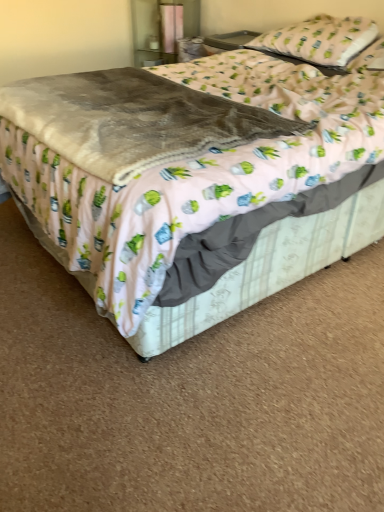
What is the approximate height of white fabric pillow at upper right, which is counted as the second pillow, starting from the top?

It is 12.10 centimeters.

This screenshot has height=512, width=384. In order to click on velvety gray blanket at center in this screenshot , I will do coord(132,120).

Locate an element on the screen. white fabric pillow at upper right, the second pillow ordered from the bottom is located at coordinates (319, 40).

Is velvet gray blanket at center far away from white fabric pillow at upper right, the second pillow ordered from the bottom?

Actually, velvet gray blanket at center and white fabric pillow at upper right, the second pillow ordered from the bottom, are a little close together.

Considering the positions of objects velvet gray blanket at center and white fabric pillow at upper right, acting as the first pillow starting from the top, in the image provided, who is more to the right, velvet gray blanket at center or white fabric pillow at upper right, acting as the first pillow starting from the top,?

white fabric pillow at upper right, acting as the first pillow starting from the top.

From the image's perspective, which is above, velvet gray blanket at center or white fabric pillow at upper right, the second pillow ordered from the bottom?

white fabric pillow at upper right, the second pillow ordered from the bottom, appears higher in the image.

Locate an element on the screen. blanket below the white fabric pillow at upper right, the second pillow ordered from the bottom (from the image's perspective) is located at coordinates tap(132, 120).

Which object is more forward, white fabric pillow at upper right, the second pillow ordered from the bottom, or velvety gray blanket at center?

Positioned in front is velvety gray blanket at center.

Which of these two, white fabric pillow at upper right, acting as the first pillow starting from the top, or velvety gray blanket at center, is wider?

With larger width is velvety gray blanket at center.

Is white fabric pillow at upper right, the second pillow ordered from the bottom, looking in the opposite direction of velvety gray blanket at center?

No, velvety gray blanket at center is not at the back of white fabric pillow at upper right, the second pillow ordered from the bottom.

From the picture: Is velvety gray blanket at center next to white fabric pillow at upper right, acting as the first pillow starting from the top?

velvety gray blanket at center and white fabric pillow at upper right, acting as the first pillow starting from the top, are not in contact.

Between velvety gray blanket at center and white fabric pillow at upper right, the second pillow ordered from the bottom, which one has larger width?

Wider between the two is velvety gray blanket at center.

Is the depth of velvety gray blanket at center less than that of white fabric pillow at upper right, acting as the first pillow starting from the top?

Yes, velvety gray blanket at center is in front of white fabric pillow at upper right, acting as the first pillow starting from the top.

Is velvety gray blanket at center to the left of white fabric pillow at upper right, the second pillow ordered from the bottom, from the viewer's perspective?

Yes, velvety gray blanket at center is to the left of white fabric pillow at upper right, the second pillow ordered from the bottom.

Is white fabric pillow at upper right, positioned as the 1th pillow in bottom-to-top order, at the back of white fabric pillow at upper right, acting as the first pillow starting from the top?

That's not correct — white fabric pillow at upper right, acting as the first pillow starting from the top, is not looking away from white fabric pillow at upper right, positioned as the 1th pillow in bottom-to-top order.

Does white fabric pillow at upper right, acting as the first pillow starting from the top, have a lesser height compared to white fabric pillow at upper right, which is counted as the second pillow, starting from the top?

Incorrect, the height of white fabric pillow at upper right, acting as the first pillow starting from the top, does not fall short of that of white fabric pillow at upper right, which is counted as the second pillow, starting from the top.

Relative to white fabric pillow at upper right, positioned as the 1th pillow in bottom-to-top order, is white fabric pillow at upper right, the second pillow ordered from the bottom, in front or behind?

Clearly, white fabric pillow at upper right, the second pillow ordered from the bottom, is behind white fabric pillow at upper right, positioned as the 1th pillow in bottom-to-top order.

Is white fabric pillow at upper right, the second pillow ordered from the bottom, located outside velvet gray blanket at center?

No, white fabric pillow at upper right, the second pillow ordered from the bottom, is not outside of velvet gray blanket at center.

Is white fabric pillow at upper right, acting as the first pillow starting from the top, far from velvet gray blanket at center?

Actually, white fabric pillow at upper right, acting as the first pillow starting from the top, and velvet gray blanket at center are a little close together.

From the picture: Is white fabric pillow at upper right, the second pillow ordered from the bottom, aimed at velvet gray blanket at center?

No.

Relative to velvet gray blanket at center, is white fabric pillow at upper right, the second pillow ordered from the bottom, in front or behind?

white fabric pillow at upper right, the second pillow ordered from the bottom, is behind velvet gray blanket at center.

From the image's perspective, which object appears higher, velvety gray blanket at center or velvet gray blanket at center?

velvety gray blanket at center appears higher in the image.

Looking at this image, can you confirm if velvety gray blanket at center is positioned to the left of velvet gray blanket at center?

Correct, you'll find velvety gray blanket at center to the left of velvet gray blanket at center.

What are the coordinates of `blanket that is behind the velvet gray blanket at center` in the screenshot? It's located at (132, 120).

Which is in front, velvety gray blanket at center or velvet gray blanket at center?

velvet gray blanket at center.

Is white fabric pillow at upper right, positioned as the 1th pillow in bottom-to-top order, touching velvety gray blanket at center?

white fabric pillow at upper right, positioned as the 1th pillow in bottom-to-top order, is not next to velvety gray blanket at center, and they're not touching.

From the image's perspective, is white fabric pillow at upper right, which is counted as the second pillow, starting from the top, on top of velvety gray blanket at center?

Yes, from the image's perspective, white fabric pillow at upper right, which is counted as the second pillow, starting from the top, is above velvety gray blanket at center.

Is white fabric pillow at upper right, which is counted as the second pillow, starting from the top, not inside velvety gray blanket at center?

That's correct, white fabric pillow at upper right, which is counted as the second pillow, starting from the top, is outside of velvety gray blanket at center.

This screenshot has height=512, width=384. I want to click on bed on the left of white fabric pillow at upper right, acting as the first pillow starting from the top, so click(x=207, y=201).

You are a GUI agent. You are given a task and a screenshot of the screen. Output one action in this format:
    pyautogui.click(x=<x>, y=<y>)
    Task: Click on the 2nd pillow behind the velvety gray blanket at center, starting your count from the anchor
    The width and height of the screenshot is (384, 512).
    Given the screenshot: What is the action you would take?
    pyautogui.click(x=319, y=40)

Looking at the image, which one is located further to velvet gray blanket at center, white fabric pillow at upper right, positioned as the 1th pillow in bottom-to-top order, or white fabric pillow at upper right, the second pillow ordered from the bottom?

The object further to velvet gray blanket at center is white fabric pillow at upper right, positioned as the 1th pillow in bottom-to-top order.

Based on their spatial positions, is white fabric pillow at upper right, acting as the first pillow starting from the top, or velvety gray blanket at center closer to white fabric pillow at upper right, positioned as the 1th pillow in bottom-to-top order?

The object closer to white fabric pillow at upper right, positioned as the 1th pillow in bottom-to-top order, is white fabric pillow at upper right, acting as the first pillow starting from the top.

Based on their spatial positions, is velvety gray blanket at center or white fabric pillow at upper right, acting as the first pillow starting from the top, further from velvet gray blanket at center?

white fabric pillow at upper right, acting as the first pillow starting from the top.

Considering their positions, is velvet gray blanket at center positioned closer to velvety gray blanket at center than white fabric pillow at upper right, the second pillow ordered from the bottom?

Based on the image, velvet gray blanket at center appears to be nearer to velvety gray blanket at center.

When comparing their distances from white fabric pillow at upper right, acting as the first pillow starting from the top, does white fabric pillow at upper right, positioned as the 1th pillow in bottom-to-top order, or velvety gray blanket at center seem closer?

white fabric pillow at upper right, positioned as the 1th pillow in bottom-to-top order.

Which object lies further to the anchor point white fabric pillow at upper right, the second pillow ordered from the bottom, velvet gray blanket at center or velvety gray blanket at center?

Based on the image, velvety gray blanket at center appears to be further to white fabric pillow at upper right, the second pillow ordered from the bottom.

When comparing their distances from white fabric pillow at upper right, the second pillow ordered from the bottom, does velvety gray blanket at center or white fabric pillow at upper right, positioned as the 1th pillow in bottom-to-top order, seem closer?

white fabric pillow at upper right, positioned as the 1th pillow in bottom-to-top order, is positioned closer to the anchor white fabric pillow at upper right, the second pillow ordered from the bottom.

Based on their spatial positions, is velvet gray blanket at center or white fabric pillow at upper right, which is counted as the second pillow, starting from the top, further from velvety gray blanket at center?

white fabric pillow at upper right, which is counted as the second pillow, starting from the top.

I want to click on blanket located between velvet gray blanket at center and white fabric pillow at upper right, acting as the first pillow starting from the top, in the depth direction, so (x=132, y=120).

I want to click on pillow located between velvet gray blanket at center and white fabric pillow at upper right, acting as the first pillow starting from the top, in the depth direction, so click(369, 58).

At what (x,y) coordinates should I click in order to perform the action: click on pillow between velvety gray blanket at center and white fabric pillow at upper right, positioned as the 1th pillow in bottom-to-top order, in the horizontal direction. Please return your answer as a coordinate pair (x, y). This screenshot has height=512, width=384. Looking at the image, I should click on (319, 40).

The image size is (384, 512). What are the coordinates of `bed between velvety gray blanket at center and white fabric pillow at upper right, which is counted as the second pillow, starting from the top, in the horizontal direction` in the screenshot? It's located at (207, 201).